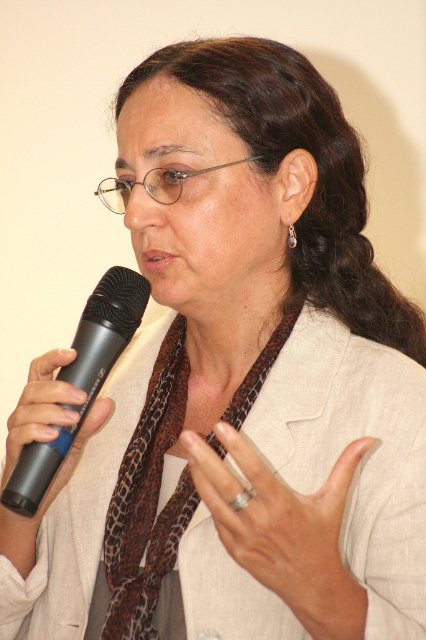
Looking at this image, based on the scene description, what object is located at the coordinates point (x=284, y=531)?

The point (x=284, y=531) marks the silver metallic ring at center.

You are organizing a photo shoot and need to ensure that the brown leopard print scarf at center and the black matte microphone at left are both visible in the frame. Given their sizes, which object might require more careful positioning to avoid being cut off?

The brown leopard print scarf at center is bigger than the black matte microphone at left, so it might require more careful positioning to avoid being cut off due to its larger size.